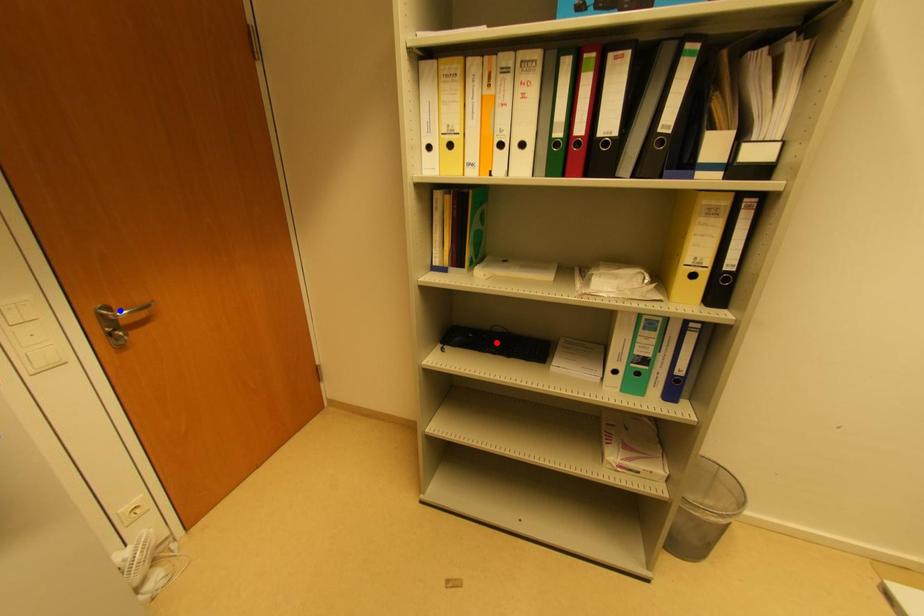
Question: Which of the two points in the image is closer to the camera?

Choices:
 (A) Blue point is closer.
 (B) Red point is closer.

Answer: (A)